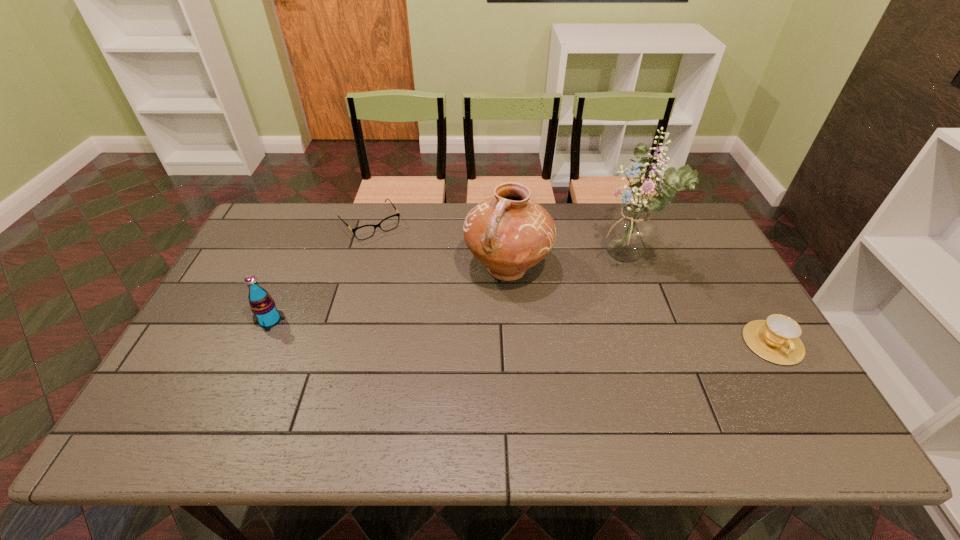
Locate an element on the screen. This screenshot has height=540, width=960. vacant space located 0.170m on the front-facing side of the fourth object from right to left is located at coordinates (406, 269).

Locate an element on the screen. This screenshot has height=540, width=960. bouquet at the far edge is located at coordinates (629, 232).

I want to click on pottery located at the far edge, so pyautogui.click(x=509, y=233).

Image resolution: width=960 pixels, height=540 pixels. Find the location of `spectacles that is at the far edge`. spectacles that is at the far edge is located at coordinates (364, 232).

Find the location of `object present at the left edge`. object present at the left edge is located at coordinates (262, 305).

Find the location of a particular element. This screenshot has width=960, height=540. object at the right edge is located at coordinates pos(776,339).

Locate an element on the screen. This screenshot has width=960, height=540. vacant space at the far edge of the desktop is located at coordinates (438, 208).

The height and width of the screenshot is (540, 960). I want to click on vacant area at the near edge, so click(x=570, y=379).

Find the location of a particular element. blank area at the left edge is located at coordinates (232, 318).

The height and width of the screenshot is (540, 960). In the image, there is a desktop. Find the location of `vacant space at the far left corner`. vacant space at the far left corner is located at coordinates pyautogui.click(x=304, y=221).